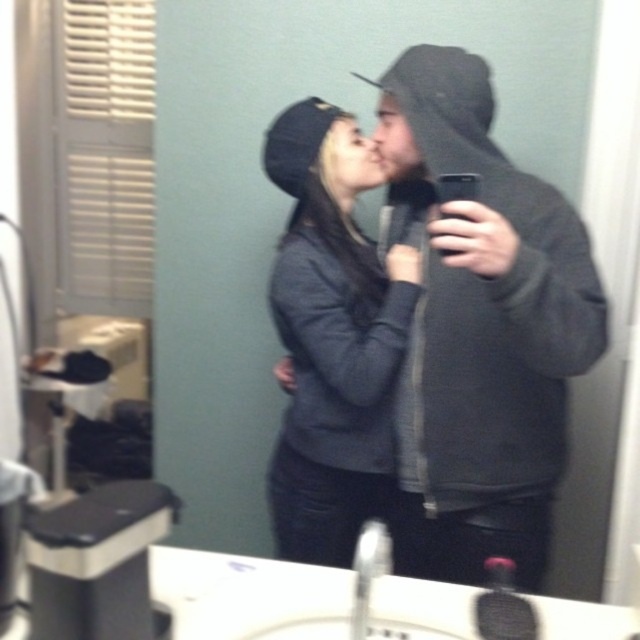
Can you confirm if dark gray hoodie at center is positioned below dark gray sweater at center?

Incorrect, dark gray hoodie at center is not positioned below dark gray sweater at center.

Who is more distant from viewer, (390,228) or (330,484)?

The point (390,228) is more distant.

In order to click on dark gray hoodie at center in this screenshot , I will do `click(481, 328)`.